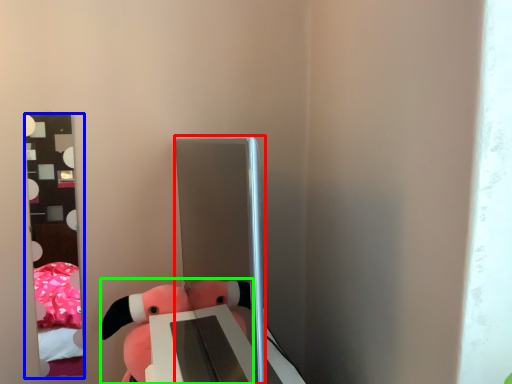
Question: Based on their relative distances, which object is nearer to glass door (highlighted by a red box)? Choose from mirror (highlighted by a blue box) and toy (highlighted by a green box).

Choices:
 (A) mirror
 (B) toy

Answer: (B)